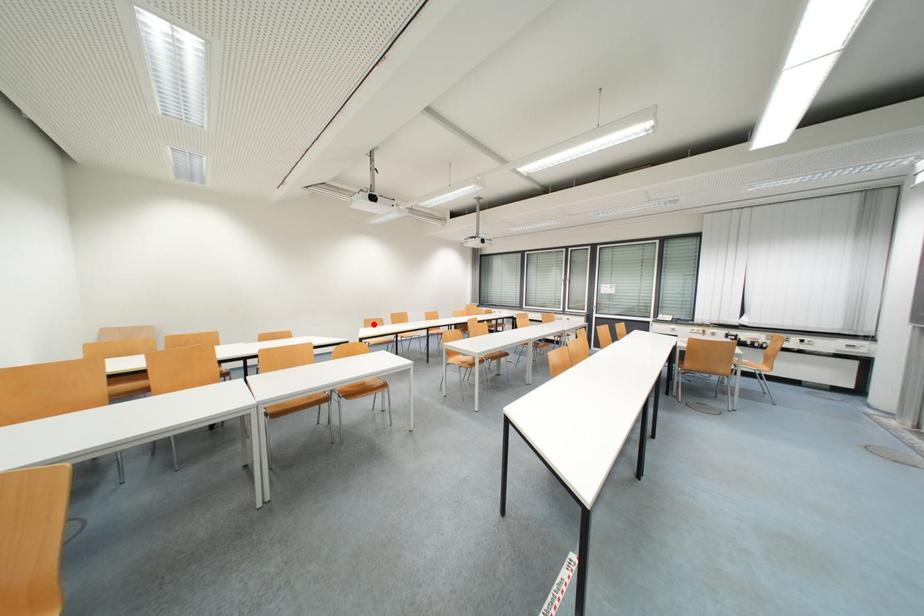
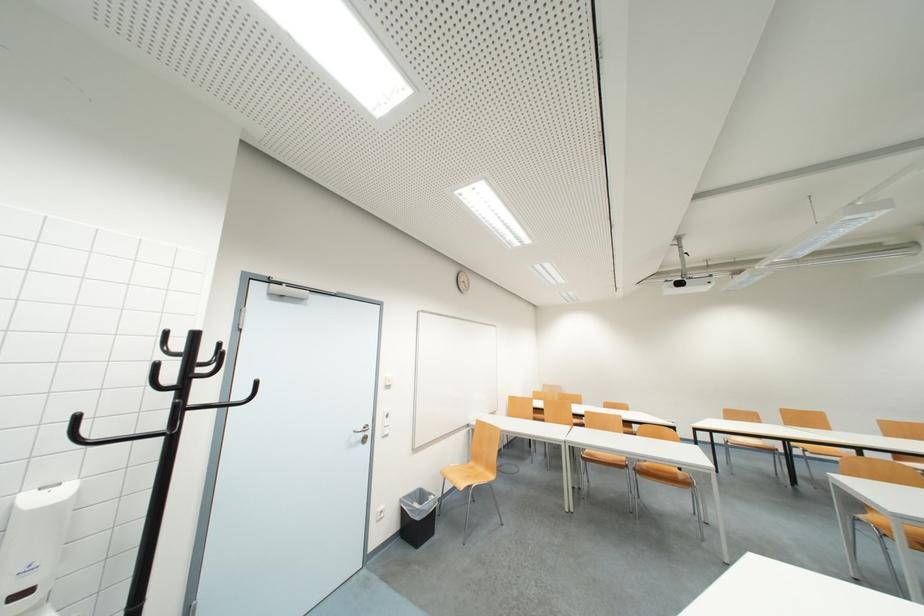
Where in the second image is the point corresponding to the highlighted location from the first image?

(736, 416)